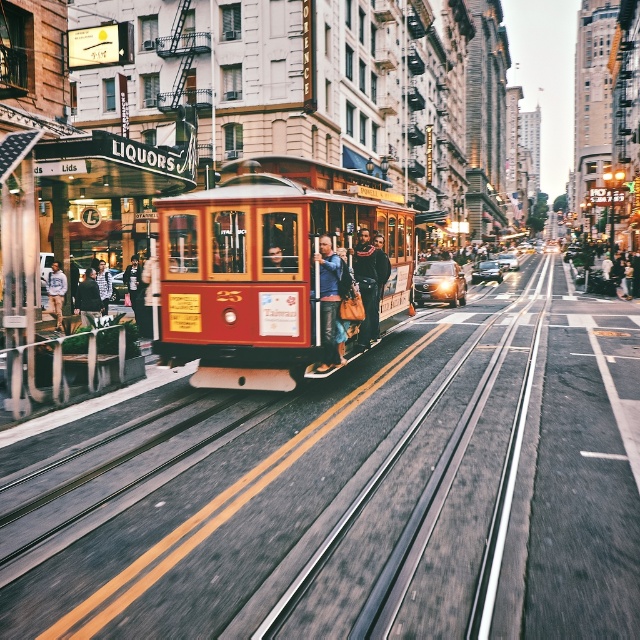
You are a tourist standing on the street and want to take a photo of the wooden polished cable car at center and the denim jacket at center. Which object should you focus on first if you want to capture both in the same frame without moving your camera?

The wooden polished cable car at center is located below the denim jacket at center, so you should focus on the denim jacket at center first to ensure both are in the frame.

You are a fashion designer observing a street scene with a dark brown leather jacket at center and a dark gray sweater at center. Which clothing item is taller when viewed from the front?

The dark brown leather jacket at center is taller than the dark gray sweater at center.